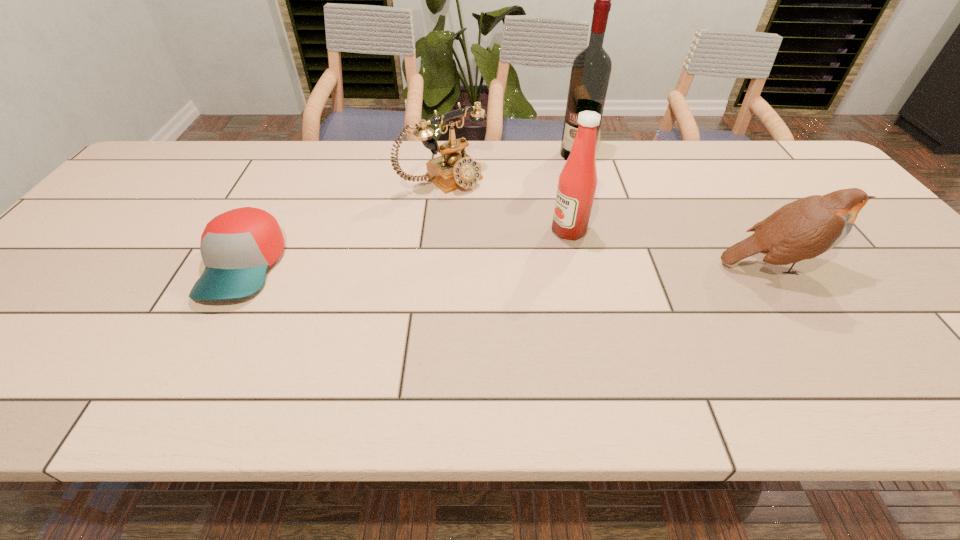
Image resolution: width=960 pixels, height=540 pixels. In order to click on the shortest object in this screenshot , I will do `click(237, 247)`.

I want to click on the leftmost object, so click(x=237, y=247).

This screenshot has width=960, height=540. I want to click on the rightmost object, so click(x=808, y=227).

This screenshot has height=540, width=960. I want to click on the second tallest object, so click(x=577, y=183).

At what (x,y) coordinates should I click in order to perform the action: click on alcohol. Please return your answer as a coordinate pair (x, y). The height and width of the screenshot is (540, 960). Looking at the image, I should click on (591, 69).

Find the location of `the second object from left to right`. the second object from left to right is located at coordinates (454, 169).

Image resolution: width=960 pixels, height=540 pixels. Identify the location of free location located 0.090m at the brim of the leftmost object. (202, 345).

Find the location of a particular element. Image resolution: width=960 pixels, height=540 pixels. free space located 0.120m at the face of the bird is located at coordinates (875, 265).

The image size is (960, 540). Find the location of `blank area located 0.200m on the front-facing side of the condiment`. blank area located 0.200m on the front-facing side of the condiment is located at coordinates (488, 264).

Locate an element on the screen. This screenshot has height=540, width=960. free space located 0.300m on the front-facing side of the condiment is located at coordinates (451, 278).